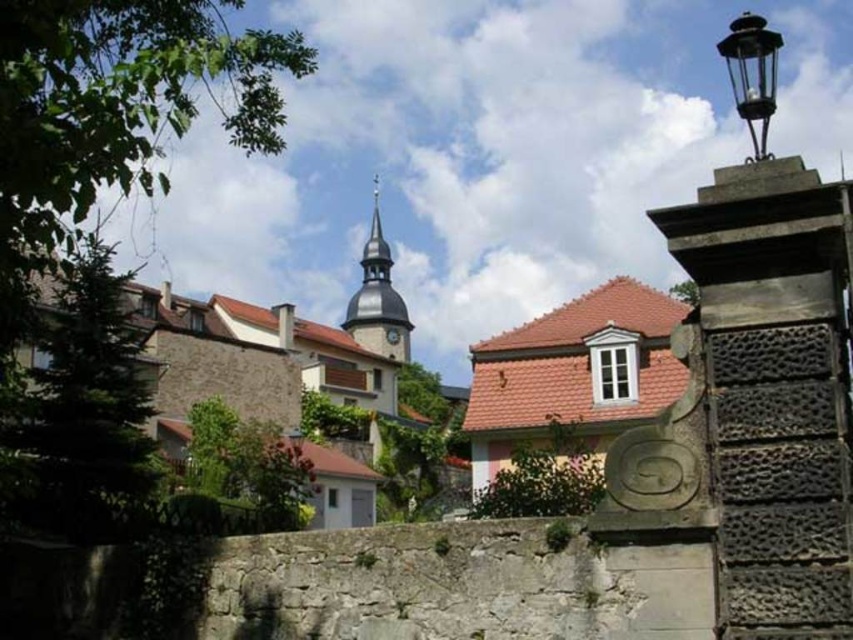
You are standing in the village square and want to take a photo of the smooth gray steeple at center. If your camera can focus up to 200 meters, will you need to adjust your position to capture it clearly?

The smooth gray steeple at center is 205.17 meters away from the viewer. Since your camera can only focus up to 200 meters, you need to move closer to ensure the steeple is within the camera range.

In the scene shown: You are standing at the center of the village square and see two points marked in the scene. The first point is at coordinate point (403,336) and the second is at point (761,125). Which point is closer to you?

Point (761,125) is closer to you because it is in front of point (403,336).

You are an architect analyzing the village layout. Based on the image, which object is taller between the smooth gray steeple at center and the metallic gray clock at center?

The smooth gray steeple at center is taller than the metallic gray clock at center according to the description.